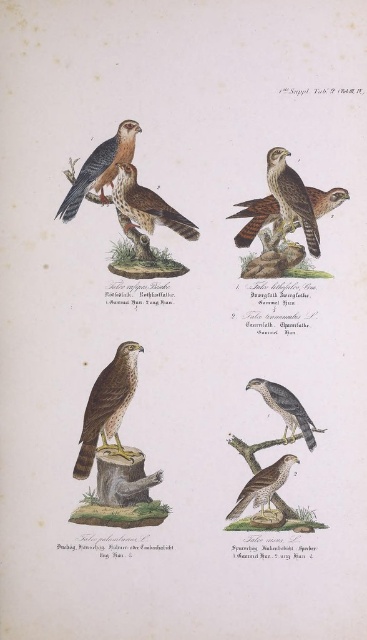
In the top left illustration, you see a brown speckled falcon at center and brown speckled feathers at upper left. Which object is positioned to the right of the other?

The brown speckled falcon at center is to the right of the brown speckled feathers at upper left.

Which falcon illustration has the brown feathered eagle at center positioned behind the brown speckled feathers at center?

The brown feathered eagle at center is behind the brown speckled feathers at center in the top left illustration.